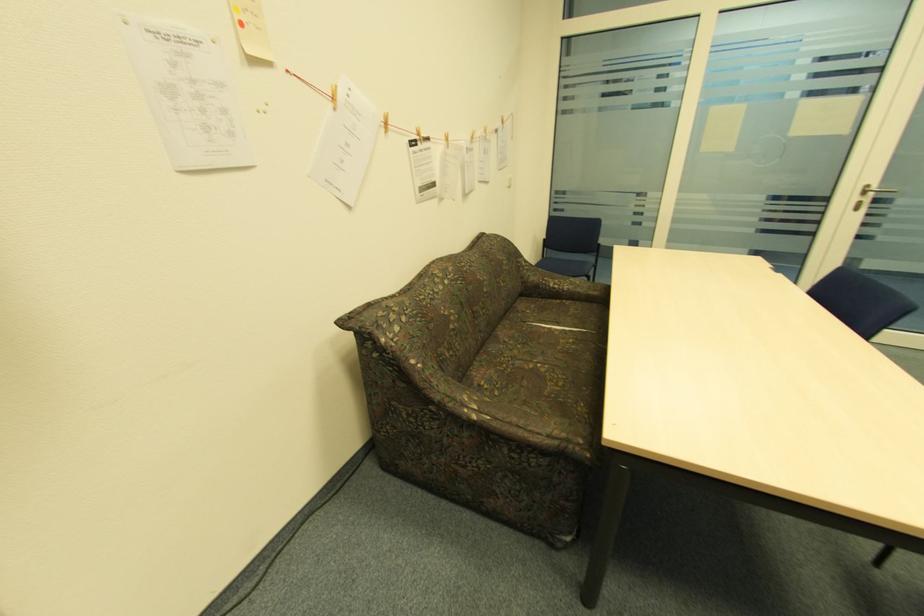
This screenshot has width=924, height=616. Identify the location of silver door handle. (869, 195).